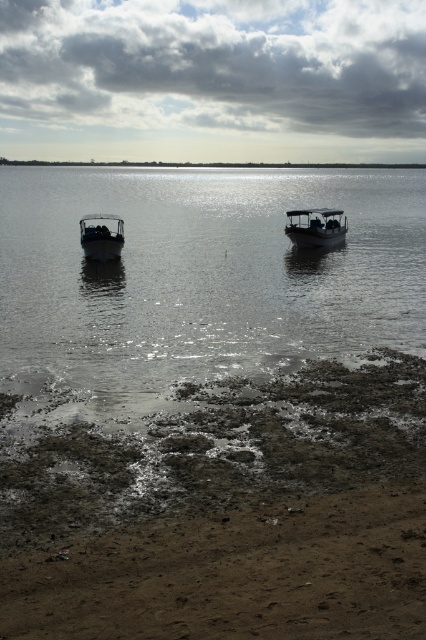
You are a photographer planning to capture the reflection of the metallic gray boat at center in the glistening metallic water at center. Based on their positions, can you determine if the boat is positioned to the left or right of the water?

The glistening metallic water at center is positioned on the left side of metallic gray boat at center, so the metallic gray boat at center is to the right of the glistening metallic water at center.

What is the exact coordinate of the glistening metallic water at center?

The glistening metallic water at center is located at point [196,280].

You are a photographer planning to capture the reflection of the glistening metallic water at center and the metallic gray boat at center in the scene. Based on their positions, which object will have a larger reflection in the water?

The glistening metallic water at center has a much taller height compared to the metallic gray boat at center, so its reflection will be larger.